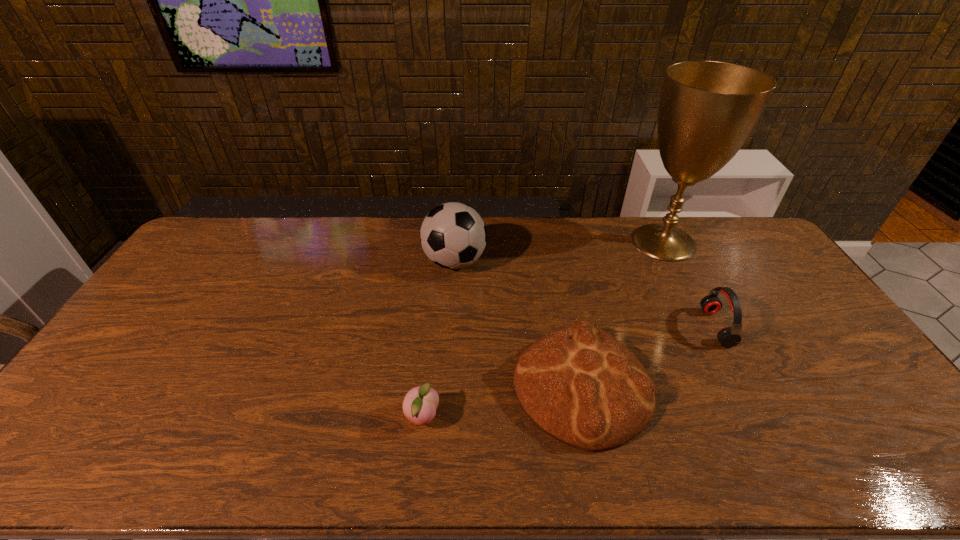
At what (x,y) coordinates should I click in order to perform the action: click on vacant area that lies between the earphone and the tallest object. Please return your answer as a coordinate pair (x, y). Looking at the image, I should click on point(690,285).

I want to click on vacant area that lies between the trophy cup and the soccer ball, so click(559, 252).

At what (x,y) coordinates should I click in order to perform the action: click on vacant area that lies between the soccer ball and the earphone. Please return your answer as a coordinate pair (x, y). Looking at the image, I should click on (586, 294).

Where is `free spot between the bread and the tallest object`? The image size is (960, 540). free spot between the bread and the tallest object is located at coordinates (622, 315).

You are a GUI agent. You are given a task and a screenshot of the screen. Output one action in this format:
    pyautogui.click(x=<x>, y=<y>)
    Task: Click on the free spot between the fourth shortest object and the shortest object
    
    Given the screenshot: What is the action you would take?
    pyautogui.click(x=439, y=339)

I want to click on vacant area that lies between the shortest object and the bread, so click(x=502, y=402).

Where is `empty location between the earphone and the soccer ball`? The image size is (960, 540). empty location between the earphone and the soccer ball is located at coordinates (586, 294).

Locate an element on the screen. The width and height of the screenshot is (960, 540). free point between the shortest object and the tallest object is located at coordinates (543, 330).

You are a GUI agent. You are given a task and a screenshot of the screen. Output one action in this format:
    pyautogui.click(x=<x>, y=<y>)
    Task: Click on the free area in between the bread and the shortest object
    The width and height of the screenshot is (960, 540).
    Given the screenshot: What is the action you would take?
    pyautogui.click(x=502, y=402)

In order to click on free space between the earphone and the soccer ball in this screenshot , I will do `click(586, 294)`.